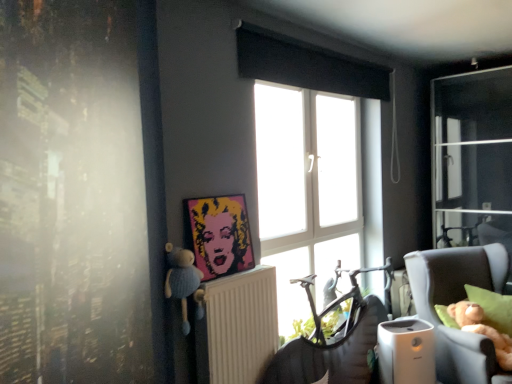
You are a GUI agent. You are given a task and a screenshot of the screen. Output one action in this format:
    pyautogui.click(x=<x>, y=<y>)
    Task: Click on the white plastic radiator at center
    
    Given the screenshot: What is the action you would take?
    pyautogui.click(x=238, y=327)

This screenshot has width=512, height=384. Describe the element at coordinates (181, 279) in the screenshot. I see `plush blue bear at left` at that location.

Find the location of a particular element. beige fabric chair at right is located at coordinates (456, 301).

The image size is (512, 384). What do you see at coordinates (312, 159) in the screenshot? I see `white glass window at center` at bounding box center [312, 159].

Identify the location of metallic silver swivel chair at center. The width and height of the screenshot is (512, 384). (330, 354).

Is point (194, 278) closer or farther from the camera than point (236, 232)?

Clearly, point (194, 278) is closer to the camera than point (236, 232).

Is plush blue bear at left not close to pop art portrait at center?

Actually, plush blue bear at left and pop art portrait at center are a little close together.

Looking at this image, based on their sizes in the image, would you say plush blue bear at left is bigger or smaller than pop art portrait at center?

In the image, plush blue bear at left appears to be smaller than pop art portrait at center.

Does plush blue bear at left have a greater width compared to pop art portrait at center?

Indeed, plush blue bear at left has a greater width compared to pop art portrait at center.

Is metallic silver swivel chair at center at the right side of white plastic radiator at center?

Indeed, metallic silver swivel chair at center is positioned on the right side of white plastic radiator at center.

Find the location of a particular element. swivel chair behind the white plastic radiator at center is located at coordinates (330, 354).

Based on the photo, which of these two, metallic silver swivel chair at center or white plastic radiator at center, is wider?

Wider between the two is metallic silver swivel chair at center.

Considering the points (327, 354) and (216, 307), which point is behind, point (327, 354) or point (216, 307)?

The point (327, 354) is behind.

Is pop art portrait at center completely or partially inside beige fabric chair at right?

No, pop art portrait at center is not surrounded by beige fabric chair at right.

Consider the image. Is beige fabric chair at right far away from pop art portrait at center?

Yes, beige fabric chair at right is far from pop art portrait at center.

Which object is closer to the camera, beige fabric chair at right or pop art portrait at center?

pop art portrait at center is closer to the camera.

Measure the distance between beige fabric chair at right and pop art portrait at center.

beige fabric chair at right is 5.23 feet away from pop art portrait at center.

Can you confirm if white plastic radiator at center is taller than white glass window at center?

Incorrect, the height of white plastic radiator at center is not larger of that of white glass window at center.

Is white plastic radiator at center positioned far away from white glass window at center?

white plastic radiator at center is near white glass window at center, not far away.

Looking at their sizes, would you say white plastic radiator at center is wider or thinner than white glass window at center?

white plastic radiator at center is thinner than white glass window at center.

The height and width of the screenshot is (384, 512). What are the coordinates of `radiator that is below the white glass window at center (from the image's perspective)` in the screenshot? It's located at (238, 327).

From a real-world perspective, is white glass window at center located beneath plush blue bear at left?

No, from a real-world perspective, white glass window at center is not under plush blue bear at left.

From the image's perspective, which is above, white glass window at center or plush blue bear at left?

white glass window at center appears higher in the image.

In the scene shown: Is the position of white glass window at center less distant than that of plush blue bear at left?

No.

Find the location of a particular element. The image size is (512, 384). window on the right of plush blue bear at left is located at coordinates (312, 159).

Who is taller, plush blue bear at left or white glass window at center?

white glass window at center.

Is plush blue bear at left at the right side of white glass window at center?

In fact, plush blue bear at left is to the left of white glass window at center.

Based on the photo, is plush blue bear at left further to the viewer compared to white glass window at center?

No, it is in front of white glass window at center.

Considering the relative positions of white glass window at center and beige fabric chair at right in the image provided, is white glass window at center to the left of beige fabric chair at right from the viewer's perspective?

Yes.

From a real-world perspective, which object stands above the other?

In real-world perspective, white glass window at center is above.

Based on the photo, is white glass window at center facing away from beige fabric chair at right?

That's not correct — white glass window at center is not looking away from beige fabric chair at right.

Find the location of a particular element. The image size is (512, 384). person above the plush blue bear at left (from a real-world perspective) is located at coordinates (220, 235).

At what (x,y) coordinates should I click in order to perform the action: click on swivel chair below the white plastic radiator at center (from a real-world perspective). Please return your answer as a coordinate pair (x, y). Looking at the image, I should click on (330, 354).

Consider the image. From the image, which object appears to be farther from white glass window at center, metallic silver swivel chair at center or plush blue bear at left?

plush blue bear at left is further to white glass window at center.

Considering their positions, is plush blue bear at left positioned further to white glass window at center than metallic silver swivel chair at center?

Among the two, plush blue bear at left is located further to white glass window at center.

From the image, which object appears to be farther from white glass window at center, metallic silver swivel chair at center or white plastic radiator at center?

white plastic radiator at center lies further to white glass window at center than the other object.

Looking at the image, which one is located closer to plush blue bear at left, pop art portrait at center or metallic silver swivel chair at center?

pop art portrait at center is positioned closer to the anchor plush blue bear at left.

Estimate the real-world distances between objects in this image. Which object is further from white glass window at center, plush blue bear at left or white plastic radiator at center?

The object further to white glass window at center is plush blue bear at left.

Looking at the image, which one is located further to white glass window at center, pop art portrait at center or beige fabric chair at right?

beige fabric chair at right is positioned further to the anchor white glass window at center.

From the picture: Looking at the image, which one is located closer to white plastic radiator at center, pop art portrait at center or beige fabric chair at right?

pop art portrait at center is positioned closer to the anchor white plastic radiator at center.

In the scene shown: From the image, which object appears to be farther from white glass window at center, white plastic radiator at center or beige fabric chair at right?

beige fabric chair at right is positioned further to the anchor white glass window at center.

Where is `person between plush blue bear at left and beige fabric chair at right in the horizontal direction`? This screenshot has height=384, width=512. person between plush blue bear at left and beige fabric chair at right in the horizontal direction is located at coordinates (220, 235).

Find the location of a particular element. The height and width of the screenshot is (384, 512). person between white plastic radiator at center and white glass window at center along the z-axis is located at coordinates (220, 235).

At what (x,y) coordinates should I click in order to perform the action: click on swivel chair situated between white glass window at center and beige fabric chair at right from left to right. Please return your answer as a coordinate pair (x, y). The image size is (512, 384). Looking at the image, I should click on (330, 354).

Locate an element on the screen. person between white glass window at center and metallic silver swivel chair at center vertically is located at coordinates (220, 235).